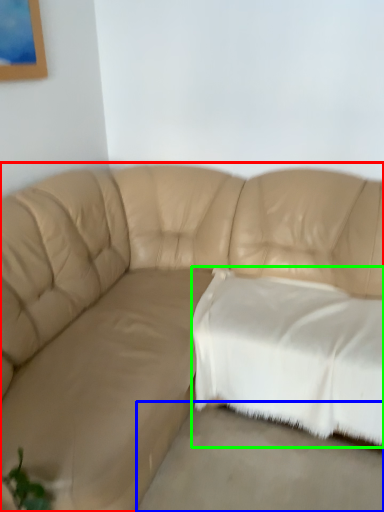
Question: Which object is the closest to the studio couch (highlighted by a red box)? Choose among these: concrete (highlighted by a blue box) or pillow (highlighted by a green box).

Choices:
 (A) concrete
 (B) pillow

Answer: (B)